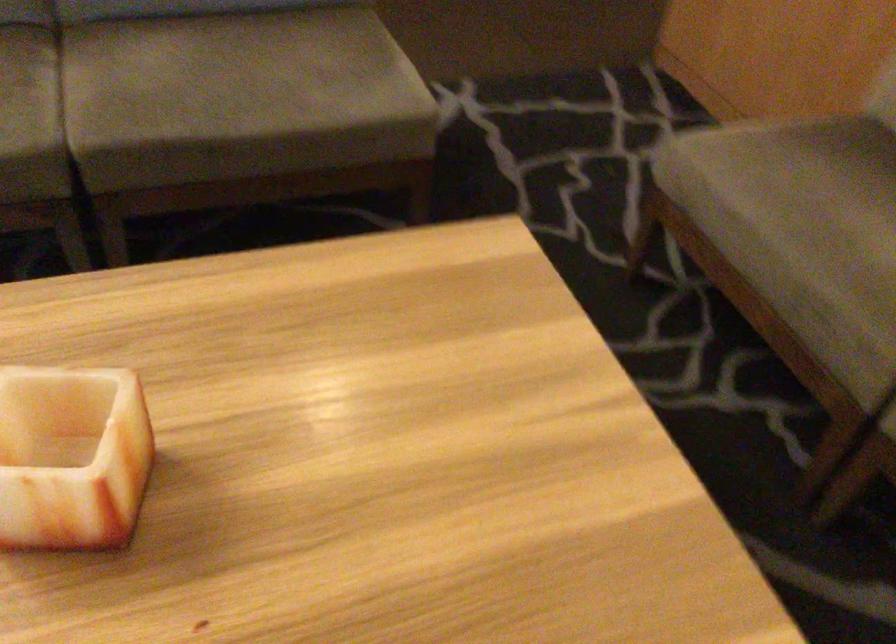
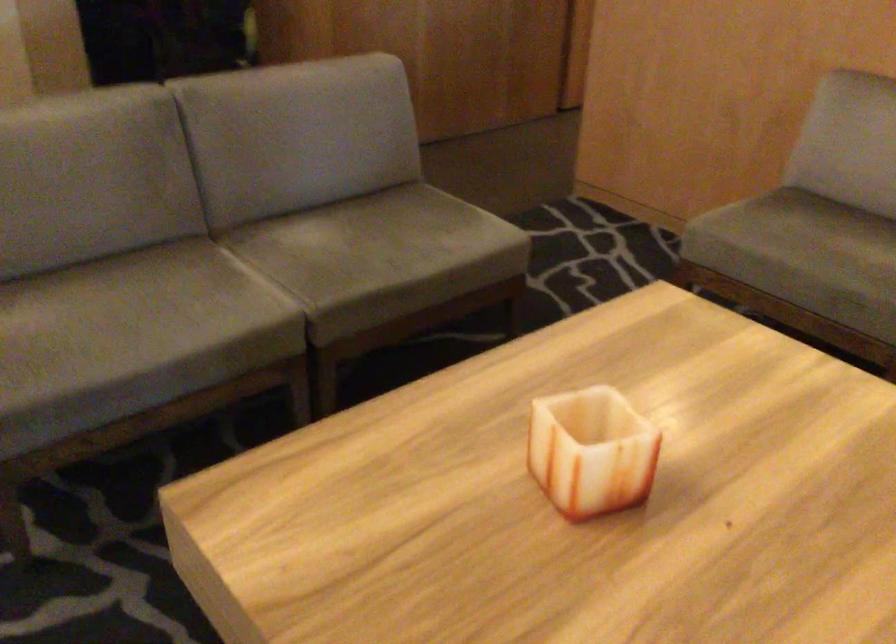
Where in the second image is the point corresponding to [788,214] from the first image?

(798, 245)